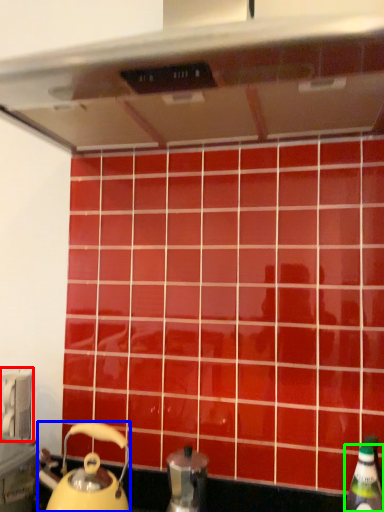
Question: Considering the real-world distances, which object is farthest from appliance (highlighted by a red box)? kettle (highlighted by a blue box) or bottle (highlighted by a green box)?

Choices:
 (A) kettle
 (B) bottle

Answer: (B)